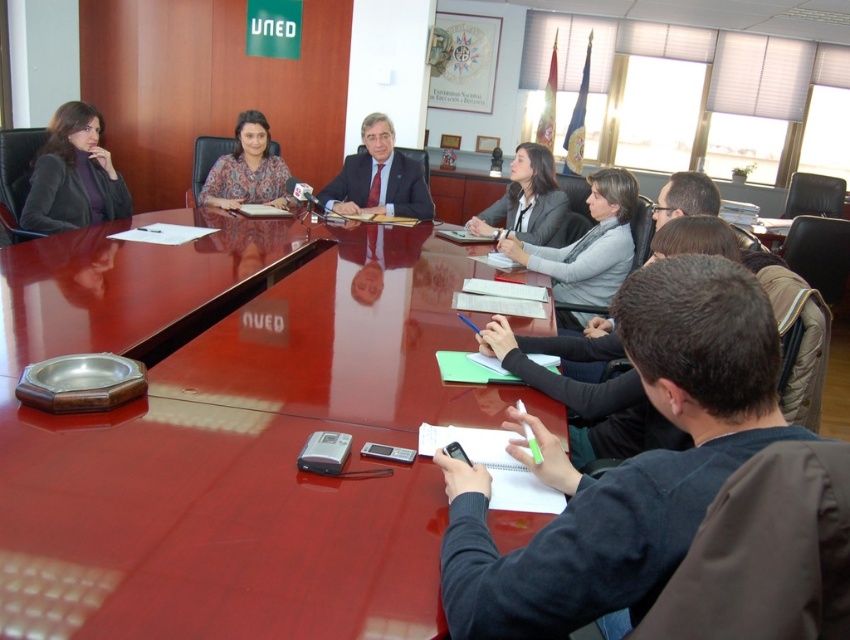
Question: Estimate the real-world distances between objects in this image. Which object is closer to the glossy wood table at center?

Choices:
 (A) patterned fabric blouse at center
 (B) gray fabric jacket at upper center
 (C) matte black suit at center
 (D) matte gray blazer at upper center

Answer: (B)

Question: Does matte black suit at center have a smaller size compared to matte gray blazer at upper center?

Choices:
 (A) no
 (B) yes

Answer: (B)

Question: Can you confirm if matte black jacket at left is positioned above gray fabric jacket at upper center?

Choices:
 (A) no
 (B) yes

Answer: (B)

Question: Among these objects, which one is farthest from the camera?

Choices:
 (A) patterned fabric blouse at center
 (B) gray fabric jacket at upper center

Answer: (A)

Question: Does matte black jacket at left have a smaller size compared to matte gray blazer at upper center?

Choices:
 (A) yes
 (B) no

Answer: (A)

Question: Based on their relative distances, which object is nearer to the matte black jacket at left?

Choices:
 (A) dark blue sweater at center
 (B) glossy wood table at center
 (C) gray fabric jacket at upper center
 (D) matte black suit at center

Answer: (B)